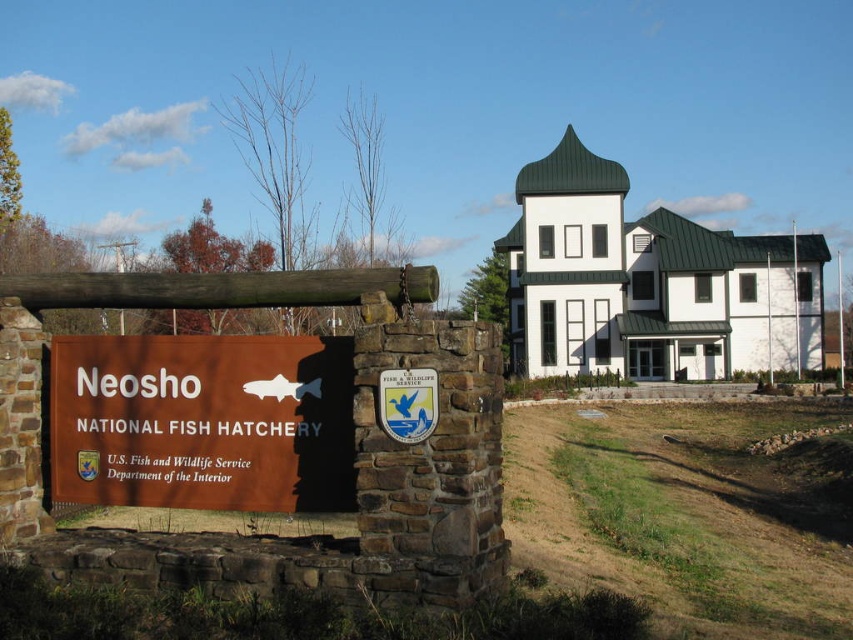
Does brown matte sign at center have a smaller size compared to white glass door at center?

Yes, brown matte sign at center is smaller than white glass door at center.

Who is higher up, brown matte sign at center or white glass door at center?

brown matte sign at center is above.

Which is behind, point (241, 444) or point (659, 362)?

Positioned behind is point (659, 362).

Identify the location of brown matte sign at center. The width and height of the screenshot is (853, 640). (202, 420).